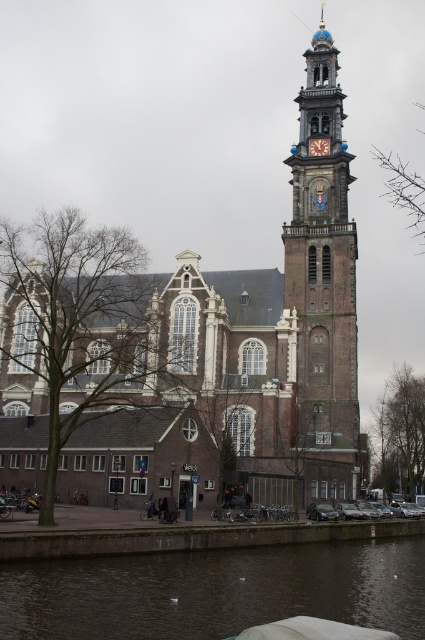
Between dark brown water at lower center and brown brick tower at right, which one appears on the right side from the viewer's perspective?

From the viewer's perspective, brown brick tower at right appears more on the right side.

This screenshot has width=425, height=640. What do you see at coordinates (215, 592) in the screenshot?
I see `dark brown water at lower center` at bounding box center [215, 592].

Where is `dark brown water at lower center`? dark brown water at lower center is located at coordinates pos(215,592).

Who is shorter, brown brick church at center or brown brick tower at right?

With less height is brown brick tower at right.

Who is positioned more to the left, brown brick church at center or brown brick tower at right?

brown brick church at center is more to the left.

Which is behind, point (328, 326) or point (306, 188)?

The point (306, 188) is more distant.

Locate an element on the screen. The image size is (425, 640). brown brick church at center is located at coordinates (272, 320).

Does point (292, 168) come behind point (200, 632)?

Yes, point (292, 168) is farther from viewer.

Between brown brick church at center and dark brown water at lower center, which one has less height?

dark brown water at lower center

What do you see at coordinates (272, 320) in the screenshot? I see `brown brick church at center` at bounding box center [272, 320].

The image size is (425, 640). Find the location of `brown brick church at center`. brown brick church at center is located at coordinates (272, 320).